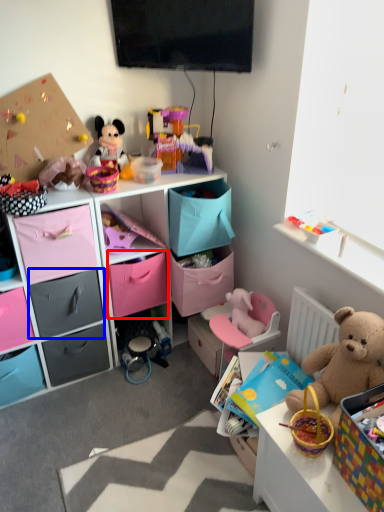
Question: Which of the following is the closest to the observer, drawer (highlighted by a red box) or drawer (highlighted by a blue box)?

Choices:
 (A) drawer
 (B) drawer

Answer: (B)